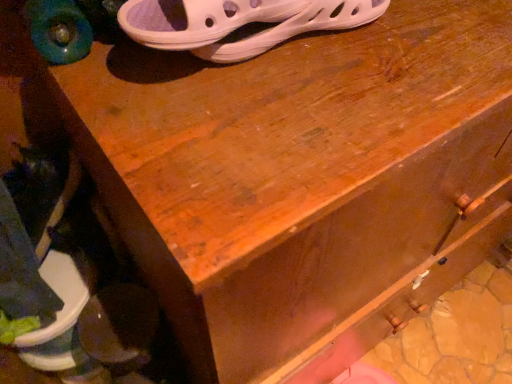
Find the location of a particular element. free spot in front of white mesh sandal at upper center, which is the 1th footwear from right to left is located at coordinates (288, 125).